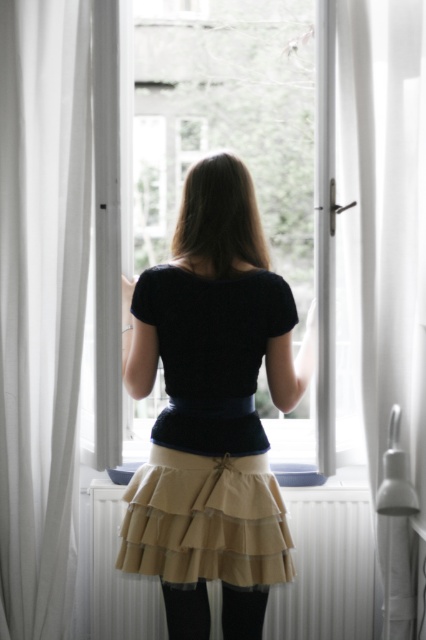
Is transparent glass window at center to the left of black cotton shirt at center from the viewer's perspective?

In fact, transparent glass window at center is to the right of black cotton shirt at center.

Who is lower down, transparent glass window at center or black cotton shirt at center?

black cotton shirt at center is below.

Locate an element on the screen. This screenshot has height=640, width=426. transparent glass window at center is located at coordinates (227, 118).

Can you confirm if transparent glass window at center is positioned to the left of black mesh tights at lower center?

Incorrect, transparent glass window at center is not on the left side of black mesh tights at lower center.

Which is more to the right, transparent glass window at center or black mesh tights at lower center?

transparent glass window at center

Identify the location of transparent glass window at center. (227, 118).

This screenshot has width=426, height=640. What are the coordinates of `transparent glass window at center` in the screenshot? It's located at (227, 118).

Does white sheer curtain at left have a lesser height compared to black cotton shirt at center?

In fact, white sheer curtain at left may be taller than black cotton shirt at center.

In the scene shown: Which is more to the left, white sheer curtain at left or black cotton shirt at center?

From the viewer's perspective, white sheer curtain at left appears more on the left side.

Where is `white sheer curtain at left`? This screenshot has width=426, height=640. white sheer curtain at left is located at coordinates (42, 304).

Identify the location of white sheer curtain at left. This screenshot has width=426, height=640. tap(42, 304).